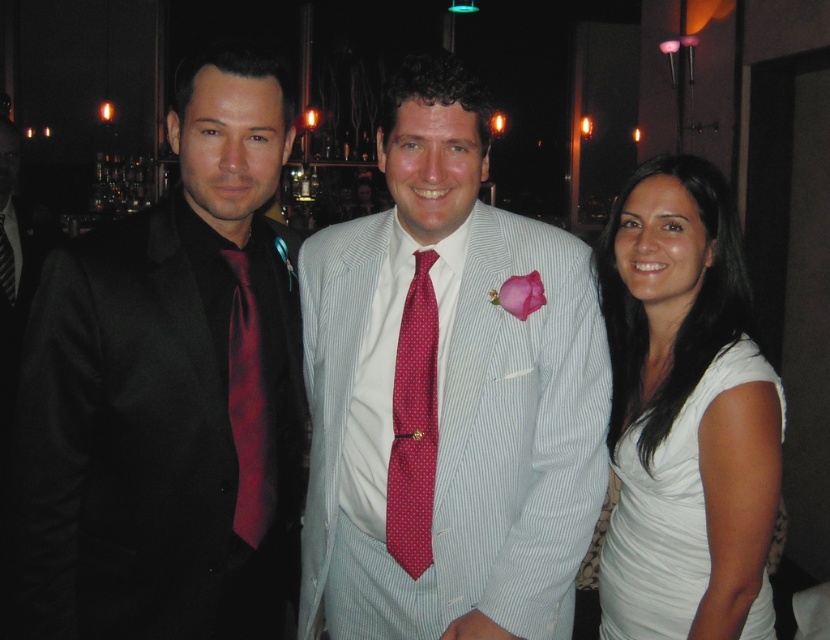
You are a photographer at this event and need to ensure that both the white satin dress at right and the red dotted tie at center are visible in your photo. Given their sizes, which one might require more careful framing to avoid being overshadowed?

The red dotted tie at center is smaller in size compared to the white satin dress at right, so it might require more careful framing to ensure it remains visible in the photo.

You are a photographer at a social event. You need to adjust the camera focus to capture both the white satin dress at right and the red dotted tie at center clearly. Given that the camera has a depth of field that can cover 20 inches, will both objects be in focus?

The white satin dress at right is 21.22 inches away from the red dotted tie at center. Since the distance between them exceeds the camera depth of field of 20 inches, they cannot both be in focus at the same time.

In the scene shown: You are a photographer at the event and need to adjust the lighting for the person in the white satin dress at right. Since the dress is 5.31 feet away, what is the minimum distance your light should be placed to effectively illuminate it?

The light should be placed at least 5.31 feet away from the viewer to effectively illuminate the white satin dress at right, matching its distance from the viewer.